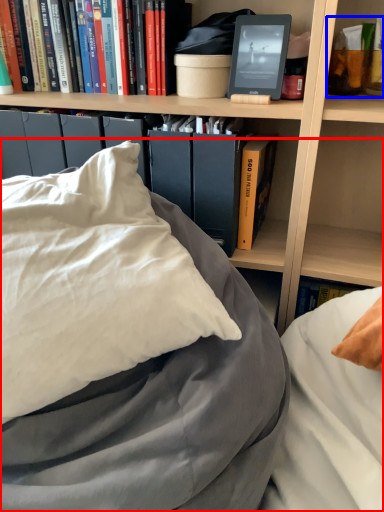
Question: Which point is closer to the camera, bed (highlighted by a red box) or book (highlighted by a blue box)?

Choices:
 (A) bed
 (B) book

Answer: (A)